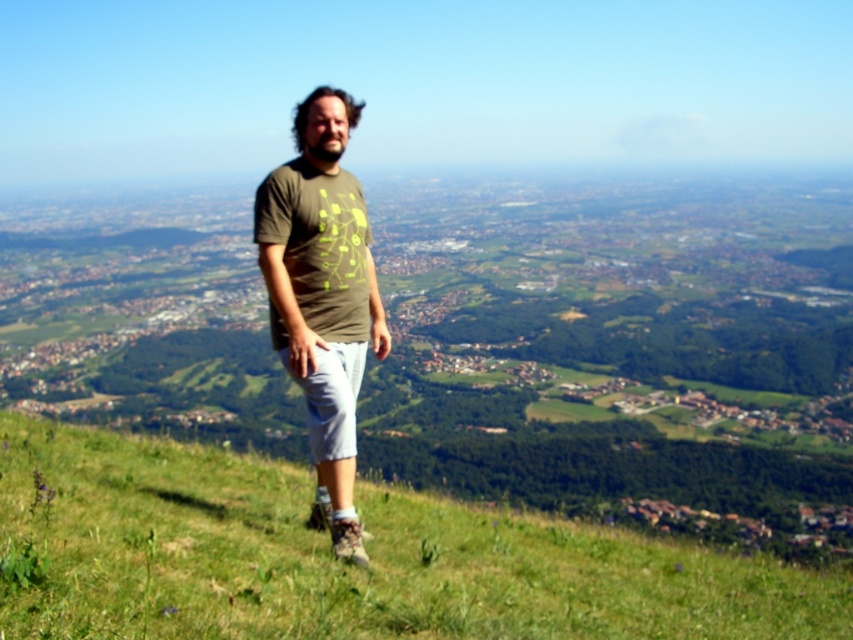
Question: Among these points, which one is nearest to the camera?

Choices:
 (A) (395, 570)
 (B) (329, 317)

Answer: (A)

Question: From the image, what is the correct spatial relationship of green grassy at center in relation to matte green t-shirt at center?

Choices:
 (A) above
 (B) below

Answer: (B)

Question: Can you confirm if green grassy at center is wider than matte green t-shirt at center?

Choices:
 (A) yes
 (B) no

Answer: (A)

Question: Which point is farther from the camera taking this photo?

Choices:
 (A) (358, 493)
 (B) (287, 205)

Answer: (A)

Question: Which point is farther to the camera?

Choices:
 (A) matte green t-shirt at center
 (B) green grassy at center

Answer: (A)

Question: Is green grassy at center thinner than matte green t-shirt at center?

Choices:
 (A) no
 (B) yes

Answer: (A)